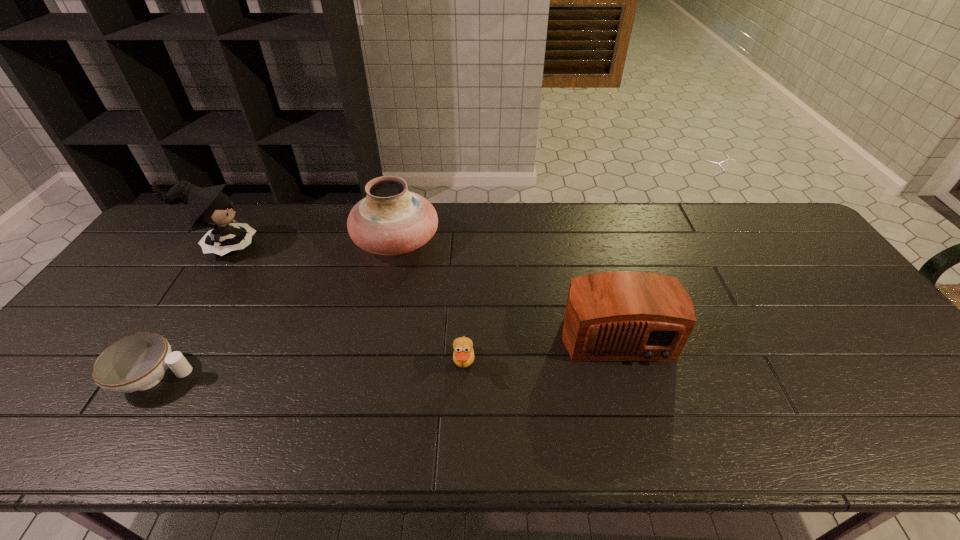
Identify the location of vacant area situated 0.090m on the front-facing side of the radio receiver. The width and height of the screenshot is (960, 540). (636, 401).

This screenshot has width=960, height=540. I want to click on free region located 0.260m on the beak of the second shortest object, so click(x=582, y=367).

In order to click on free space located 0.270m on the side with the handle of the shortest object in this screenshot , I will do `click(310, 378)`.

Where is `doll present at the far edge`? This screenshot has height=540, width=960. doll present at the far edge is located at coordinates (210, 207).

Locate an element on the screen. pottery at the far edge is located at coordinates (390, 220).

At what (x,y) coordinates should I click in order to perform the action: click on object that is at the left edge. Please return your answer as a coordinate pair (x, y). Looking at the image, I should click on (210, 207).

Identify the location of object situated at the far left corner. (210, 207).

In order to click on vacant space at the far edge of the desktop in this screenshot , I will do `click(531, 229)`.

Identify the location of vacant space at the near edge. (273, 447).

You are a GUI agent. You are given a task and a screenshot of the screen. Output one action in this format:
    pyautogui.click(x=<x>, y=<y>)
    Task: Click on the vacant space at the left edge of the desktop
    
    Given the screenshot: What is the action you would take?
    pyautogui.click(x=179, y=259)